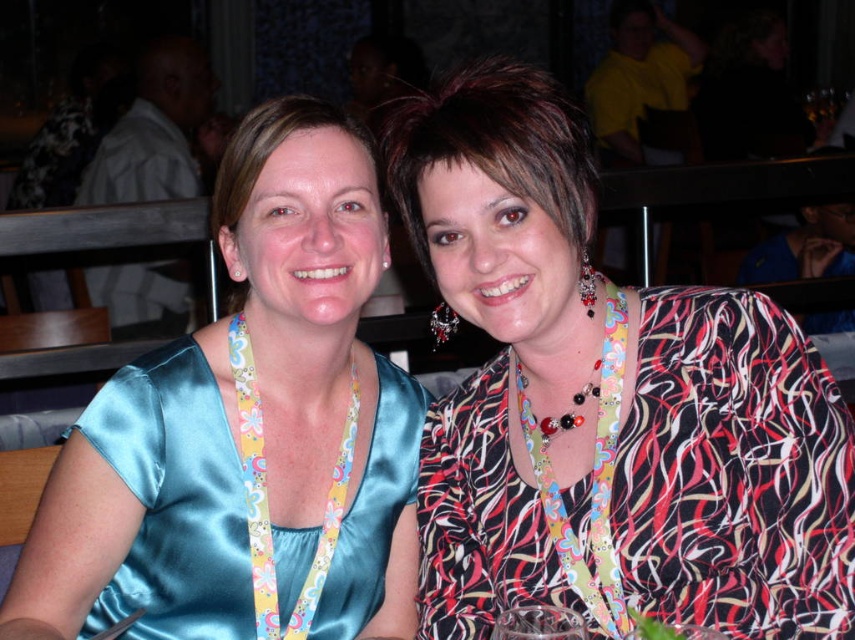
You are a photographer trying to capture a clear shot of both the satin blue dress at center and the satin dress at left. Since the background is slightly out of focus, which dress should you adjust your camera focus on to ensure it appears sharp in the photo?

The satin blue dress at center is in front of the satin dress at left, so you should focus on the satin blue dress at center to ensure it appears sharp. However, since the satin dress at left is behind, it might be out of focus. To capture both sharply, adjust the focus between them or use a smaller aperture for greater depth of field.

You are a photographer adjusting your camera to focus on the printed silk blouse at center and the satin blue dress at center. Which one is positioned higher in the frame?

The printed silk blouse at center is above the satin blue dress at center, so it is positioned higher in the frame.

You are a photographer trying to adjust your camera focus between two points in the image. The first point is at coordinate point (747, 545) and the second is at point (310, 564). Which point is closer to you and should be in focus?

Point (747, 545) is closer to the viewer than point (310, 564), so it should be in focus.